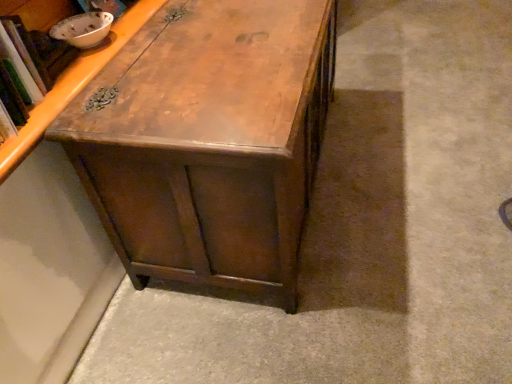
Question: Is point (287, 122) positioned closer to the camera than point (140, 16)?

Choices:
 (A) closer
 (B) farther

Answer: (A)

Question: From a real-world perspective, is wooden chest at center above or below wooden cabinet at upper left?

Choices:
 (A) below
 (B) above

Answer: (A)

Question: Do you think wooden chest at center is within wooden cabinet at upper left, or outside of it?

Choices:
 (A) inside
 (B) outside

Answer: (B)

Question: Relative to wooden chest at center, is wooden cabinet at upper left in front or behind?

Choices:
 (A) front
 (B) behind

Answer: (A)

Question: Considering the relative positions of wooden cabinet at upper left and wooden chest at center in the image provided, is wooden cabinet at upper left to the left or to the right of wooden chest at center?

Choices:
 (A) right
 (B) left

Answer: (B)

Question: From a real-world perspective, is wooden cabinet at upper left positioned above or below wooden chest at center?

Choices:
 (A) above
 (B) below

Answer: (A)

Question: Considering the positions of point (15, 155) and point (139, 256), is point (15, 155) closer or farther from the camera than point (139, 256)?

Choices:
 (A) closer
 (B) farther

Answer: (A)